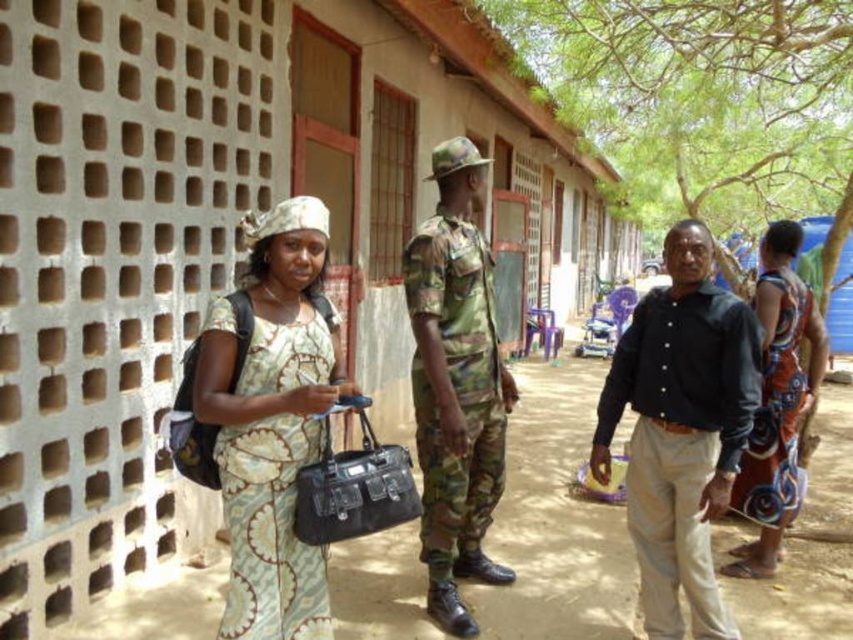
You are a fashion designer observing two dresses in an outdoor setting. The scene includes a building with a perforated brick wall and a dirt ground. You notice the patterned fabric dress at center and the printed fabric dress at right. Which dress has a narrower width?

The patterned fabric dress at center has a lesser width compared to the printed fabric dress at right.

You are a photographer at the scene. You want to take a photo that includes both the black cotton shirt at center and the camouflage fabric uniform at center. Which one will appear larger in the photo?

The black cotton shirt at center will appear larger in the photo because it is closer to the viewer than the camouflage fabric uniform at center.

You are a fashion designer observing two dresses in a photo. The first is a patterned fabric dress at center, and the second is a printed fabric dress at right. Which dress is smaller in size?

The patterned fabric dress at center has a smaller size compared to the printed fabric dress at right.